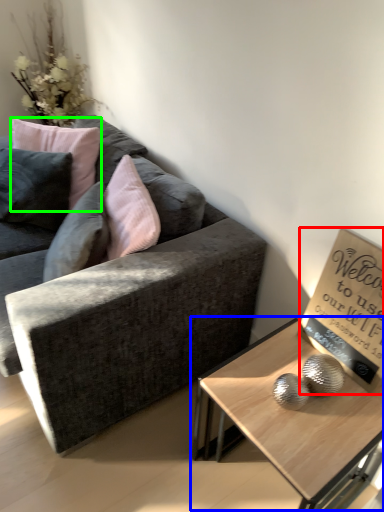
Question: Estimate the real-world distances between objects in this image. Which object is farther from bulletin board (highlighted by a red box), coffee table (highlighted by a blue box) or pillow (highlighted by a green box)?

Choices:
 (A) coffee table
 (B) pillow

Answer: (B)